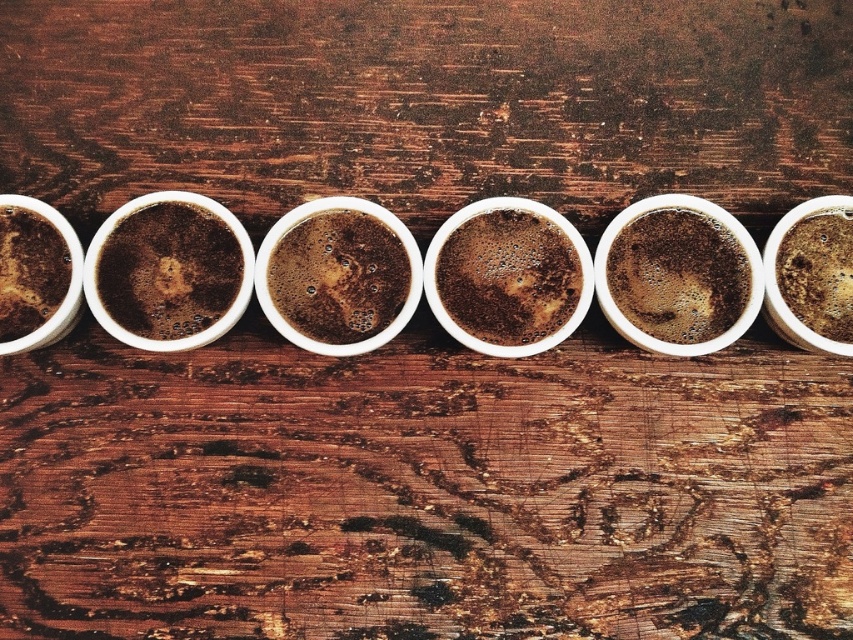
You are a barista checking the height of the foam on the cups. You have two cups to compare, the smokey brown foam at center and the matte brown coffee at left. Which one has a taller foam?

The smokey brown foam at center is taller than the matte brown coffee at left.

You are a barista arranging cups on a wooden counter. You have a brown matte cup at center and a smokey brown foam at right. Which object is positioned higher in the image?

The brown matte cup at center is above the smokey brown foam at right, so the brown matte cup at center is positioned higher in the image.

You are standing in front of the wooden surface with the six white cups. You notice two points marked on the image at coordinates point (506, 237) and point (836, 326). Which point is closer to you?

Point (506, 237) is closer to you because it is further to the viewer than point (836, 326).